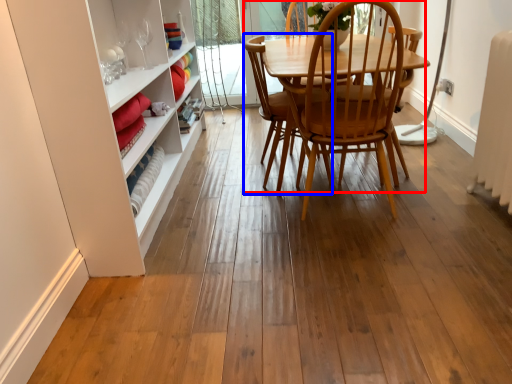
Question: Which point is further to the camera, chair (highlighted by a red box) or armchair (highlighted by a blue box)?

Choices:
 (A) chair
 (B) armchair

Answer: (B)